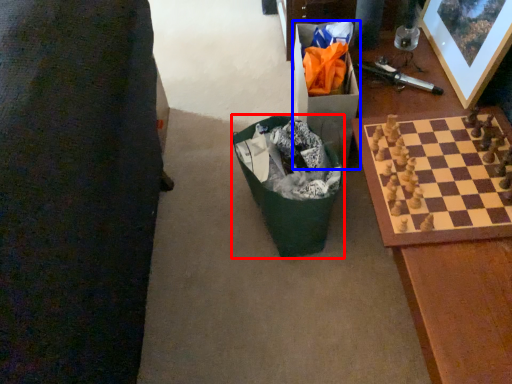
Question: Which of the following is the closest to the observer, recycling bin (highlighted by a red box) or cardboard box (highlighted by a blue box)?

Choices:
 (A) recycling bin
 (B) cardboard box

Answer: (A)